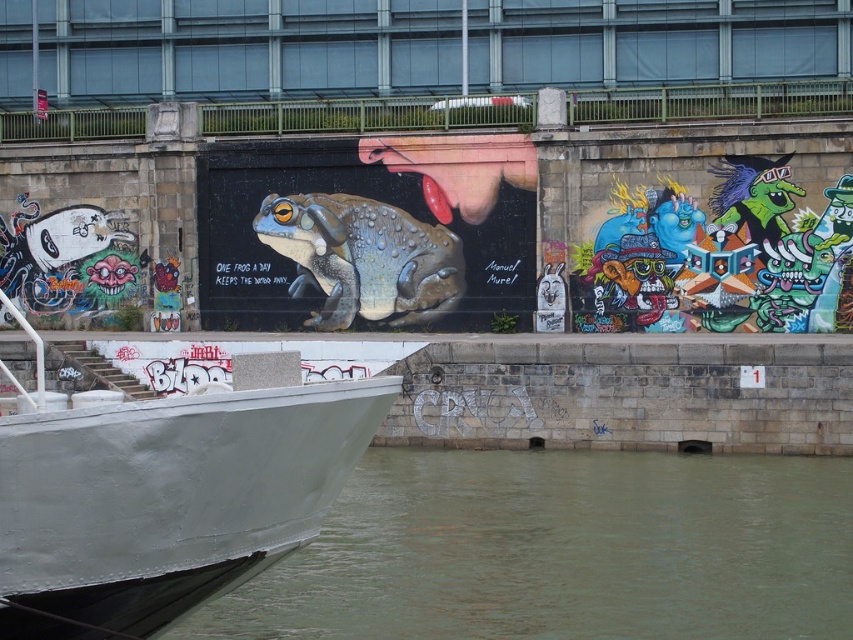
Question: Which point appears farthest from the camera in this image?

Choices:
 (A) (210, 576)
 (B) (653, 548)

Answer: (B)

Question: Where is greenish water at lower left located in relation to metallic gray boat at center in the image?

Choices:
 (A) left
 (B) right

Answer: (B)

Question: Among these objects, which one is farthest from the camera?

Choices:
 (A) greenish water at lower left
 (B) metallic gray boat at center

Answer: (A)

Question: Does greenish water at lower left have a smaller size compared to metallic gray boat at center?

Choices:
 (A) no
 (B) yes

Answer: (B)

Question: Is greenish water at lower left wider than metallic gray boat at center?

Choices:
 (A) yes
 (B) no

Answer: (B)

Question: Which object is farther from the camera taking this photo?

Choices:
 (A) greenish water at lower left
 (B) metallic gray boat at center

Answer: (A)